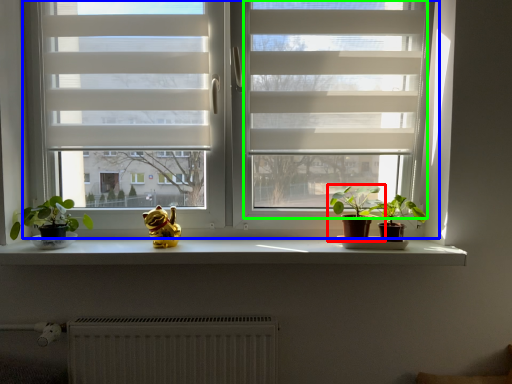
Question: Based on their relative distances, which object is farther from houseplant (highlighted by a red box)? Choose from window (highlighted by a blue box) and screen door (highlighted by a green box).

Choices:
 (A) window
 (B) screen door

Answer: (A)